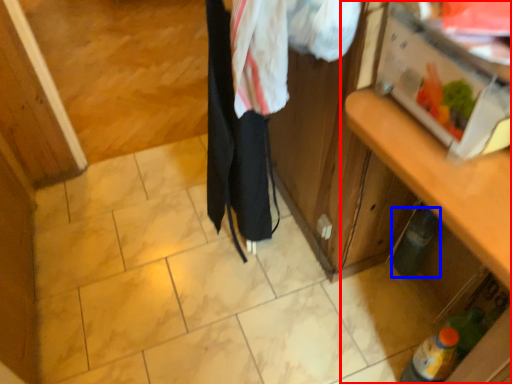
Question: Which object is further to the camera taking this photo, cabinetry (highlighted by a red box) or bottle (highlighted by a blue box)?

Choices:
 (A) cabinetry
 (B) bottle

Answer: (B)